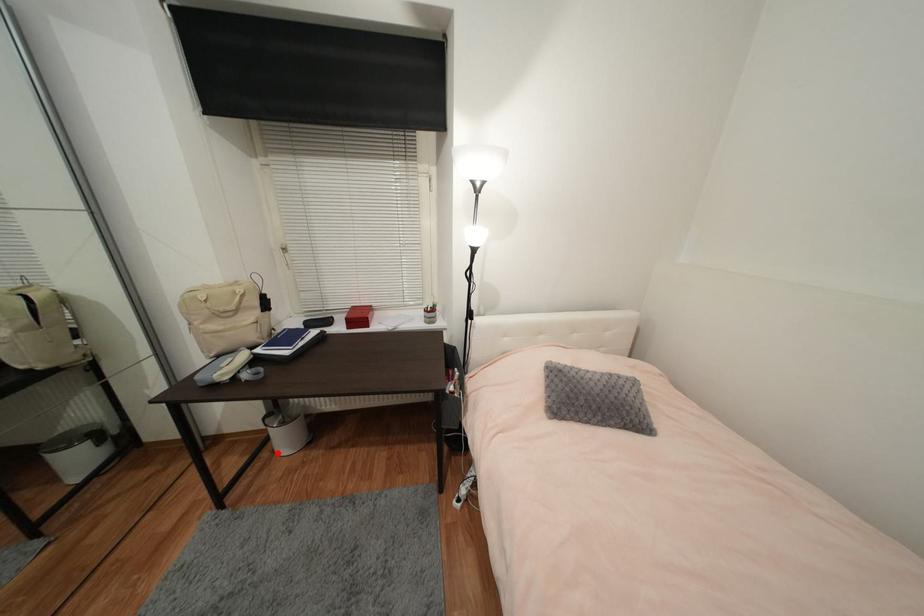
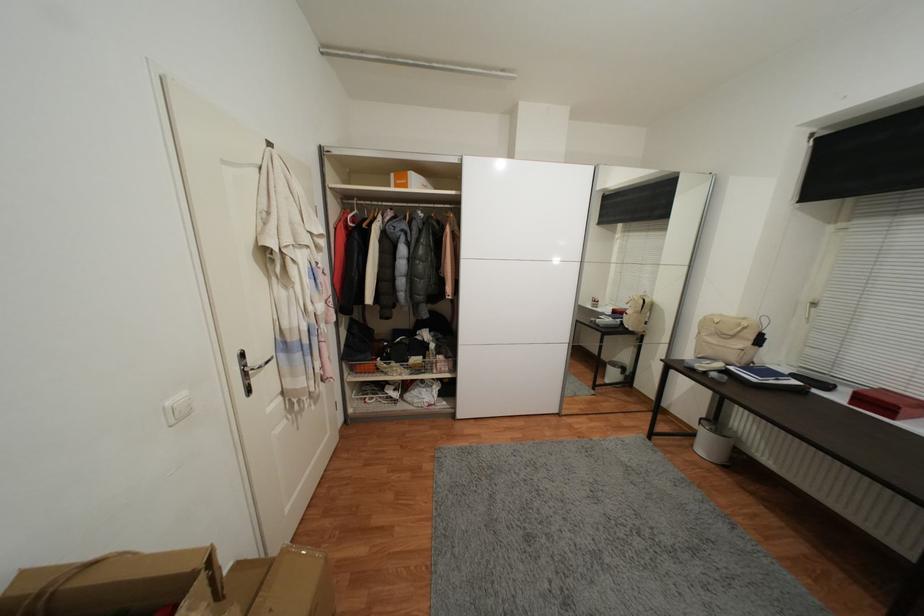
The point at the highlighted location is marked in the first image. Where is the corresponding point in the second image?

(697, 447)